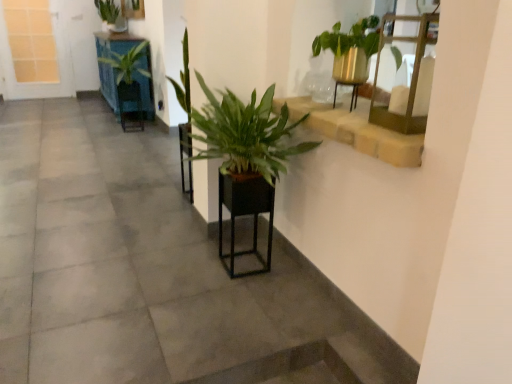
Question: Visually, is green leafy plant at upper left, which appears as the 1th houseplant when viewed from the back, positioned to the left or to the right of green matte plant at center, placed as the second armchair when sorted from left to right?

Choices:
 (A) left
 (B) right

Answer: (A)

Question: Is green leafy plant at upper left, acting as the first houseplant starting from the left, taller or shorter than green matte plant at center, placed as the second armchair when sorted from left to right?

Choices:
 (A) tall
 (B) short

Answer: (B)

Question: Which object is the closest to the green leafy plant at upper left, which is counted as the third houseplant, starting from the right?

Choices:
 (A) green leafy plant at upper left, the 2th houseplant when ordered from left to right
 (B) stone textured window sill at upper right
 (C) matte black armchair at center, which ranks as the third armchair in bottom-to-top order
 (D) white grid glass at upper left
 (E) gold metallic shelf at upper right

Answer: (A)

Question: Which is nearer to the green leafy plant at upper left, the third houseplant in the front-to-back sequence?

Choices:
 (A) smooth concrete at center
 (B) green leafy plant at center, which appears as the 1th houseplant when viewed from the right
 (C) brown wooden stairwell at lower center
 (D) white grid glass at upper left
 (E) black matte planter at center, the 3th armchair positioned from the back

Answer: (D)